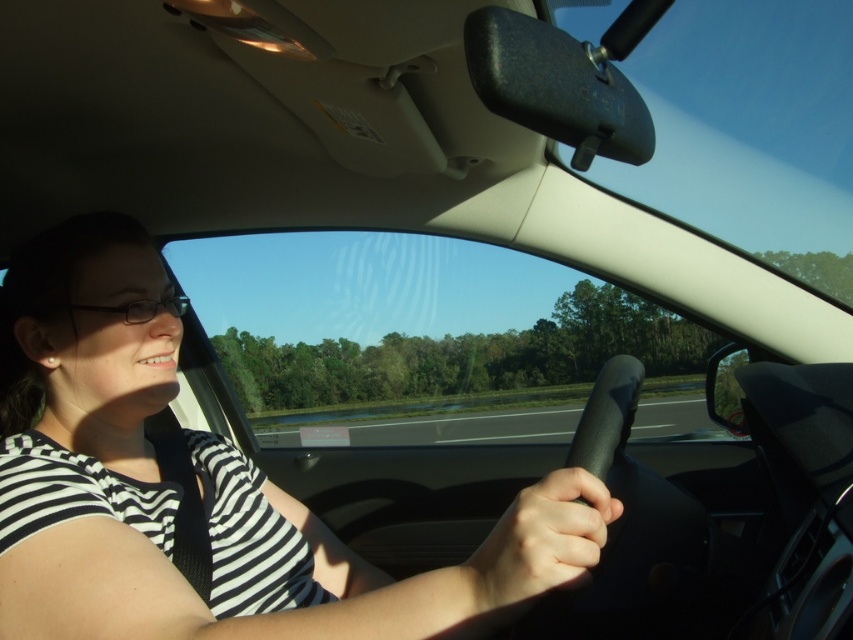
Between asphalt road at center and clear plastic glasses at left, which one has less height?

clear plastic glasses at left is shorter.

Is point (320, 436) farther from viewer compared to point (68, 305)?

Yes, point (320, 436) is behind point (68, 305).

Find the location of a particular element. The width and height of the screenshot is (853, 640). asphalt road at center is located at coordinates (432, 420).

Locate an element on the screen. Image resolution: width=853 pixels, height=640 pixels. asphalt road at center is located at coordinates (432, 420).

Can you confirm if white striped shirt at center is positioned to the right of clear plastic glasses at left?

Correct, you'll find white striped shirt at center to the right of clear plastic glasses at left.

Where is `white striped shirt at center`? Image resolution: width=853 pixels, height=640 pixels. white striped shirt at center is located at coordinates (212, 490).

At what (x,y) coordinates should I click in order to perform the action: click on white striped shirt at center. Please return your answer as a coordinate pair (x, y). The width and height of the screenshot is (853, 640). Looking at the image, I should click on (212, 490).

Does point (300, 564) come closer to viewer compared to point (363, 444)?

Yes, point (300, 564) is in front of point (363, 444).

Can you confirm if white striped shirt at center is taller than asphalt road at center?

Yes, white striped shirt at center is taller than asphalt road at center.

Does point (286, 556) come closer to viewer compared to point (639, 429)?

Yes, point (286, 556) is in front of point (639, 429).

This screenshot has width=853, height=640. I want to click on white striped shirt at center, so [212, 490].